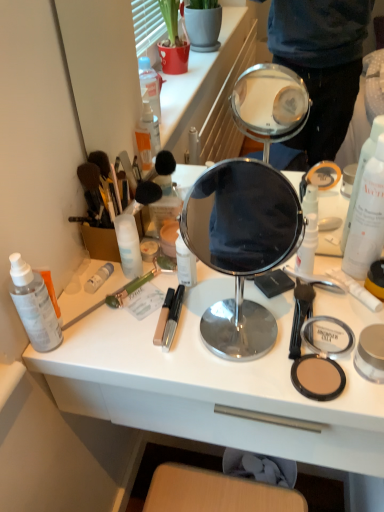
Locate an element on the screen. empty space that is in between green plastic brush at lower left and matte yellow compact powder at right, placed as the 6th toiletry when sorted from left to right is located at coordinates (210, 298).